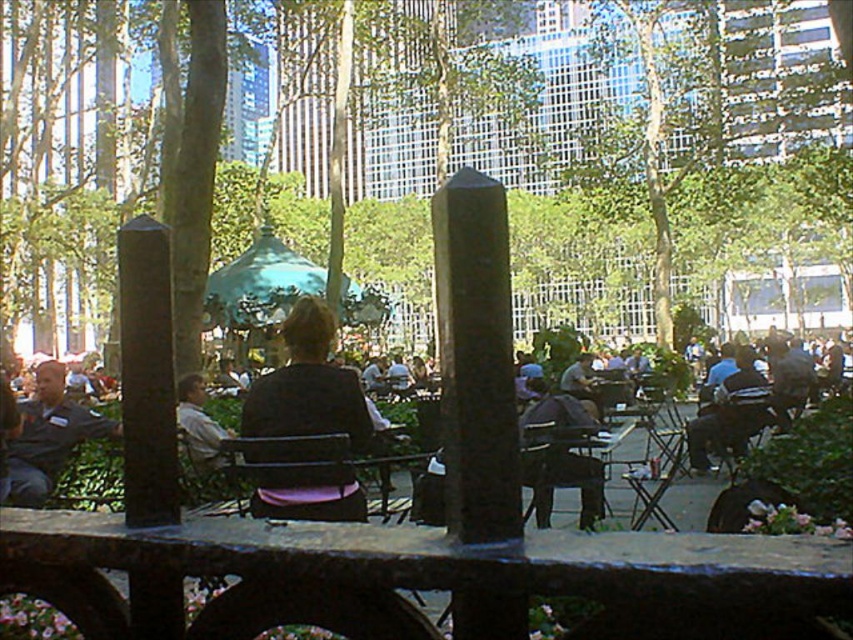
Question: Can you confirm if dark brown leather jacket at center is bigger than dark gray jacket at center?

Choices:
 (A) yes
 (B) no

Answer: (A)

Question: Which point appears farthest from the camera in this image?

Choices:
 (A) tap(843, 499)
 (B) tap(622, 177)

Answer: (B)

Question: Is black stone pillar at center to the right of dark blue shirt at left from the viewer's perspective?

Choices:
 (A) yes
 (B) no

Answer: (A)

Question: Estimate the real-world distances between objects in this image. Which object is closer to the dark blue shirt at left?

Choices:
 (A) black fabric chair at center
 (B) black plastic chair at center

Answer: (A)

Question: Which of the following is the closest to the observer?

Choices:
 (A) coord(218,456)
 (B) coord(361,566)
 (C) coord(27,204)
 (D) coord(309,316)

Answer: (B)

Question: Does smooth stone table at center have a greater width compared to black stone pillar at center?

Choices:
 (A) no
 (B) yes

Answer: (B)